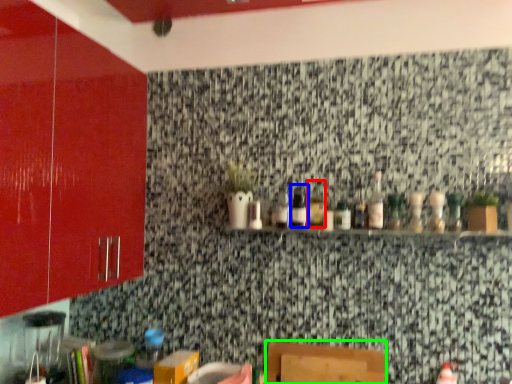
Question: Which is nearer to the bottle (highlighted by a red box)? bottle (highlighted by a blue box) or furniture (highlighted by a green box).

Choices:
 (A) bottle
 (B) furniture

Answer: (A)